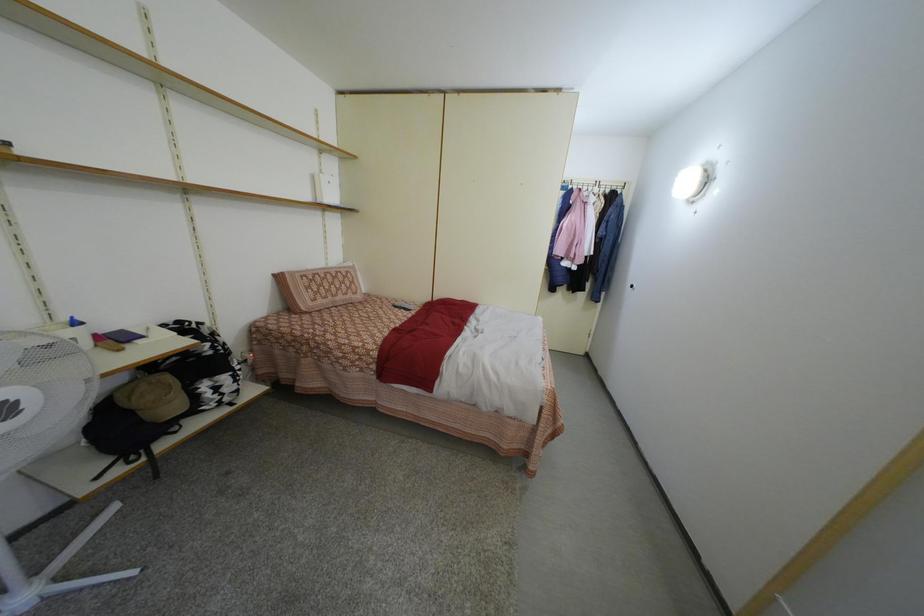
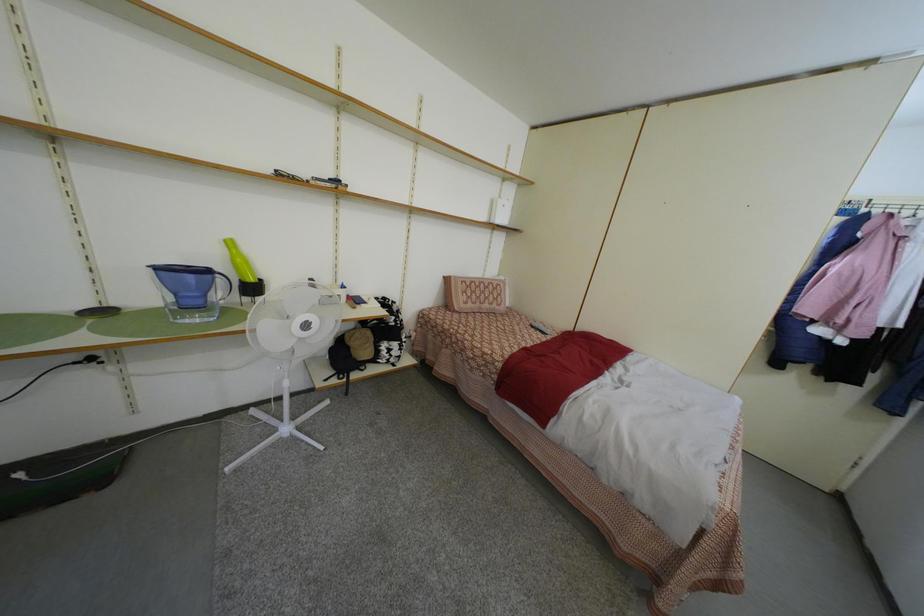
Question: The camera is either moving clockwise (left) or counter-clockwise (right) around the object. The first image is from the beginning of the video and the second image is from the end. Is the camera moving left or right when shooting the video?

Choices:
 (A) Left
 (B) Right

Answer: (B)